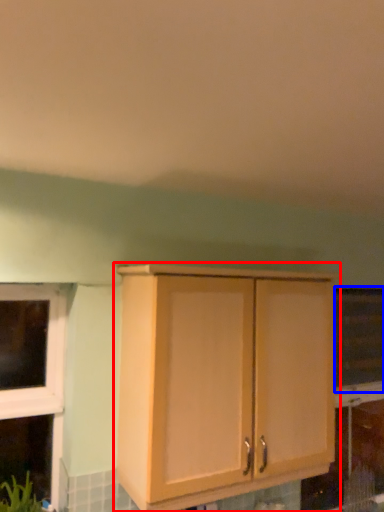
Question: Among these objects, which one is nearest to the camera, cabinetry (highlighted by a red box) or window screen (highlighted by a blue box)?

Choices:
 (A) cabinetry
 (B) window screen

Answer: (A)